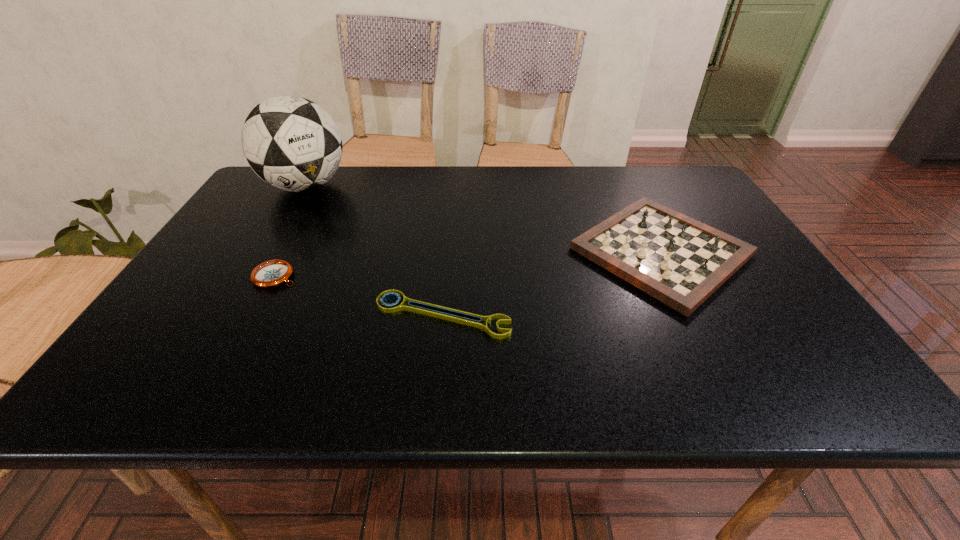
The image size is (960, 540). In order to click on empty space between the shortest object and the tallest object in this screenshot , I will do [x=374, y=251].

This screenshot has width=960, height=540. What are the coordinates of `free area in between the shortest object and the second shortest object` in the screenshot? It's located at (359, 296).

Identify the location of vacant space that is in between the third shortest object and the soccer ball. (483, 219).

I want to click on object that is the closest to the soccer ball, so click(272, 273).

Where is `the closest object to the second shortest object`? The image size is (960, 540). the closest object to the second shortest object is located at coordinates (453, 315).

This screenshot has height=540, width=960. I want to click on vacant area that satisfies the following two spatial constraints: 1. on the surface of the second tallest object where the brand logo is visible; 2. on the left side of the soccer ball, so click(267, 252).

You are a GUI agent. You are given a task and a screenshot of the screen. Output one action in this format:
    pyautogui.click(x=<x>, y=<y>)
    Task: Click on the free spot that satisfies the following two spatial constraints: 1. on the surface of the soccer ball where the brand logo is visible; 2. on the left side of the second object from right to left
    This screenshot has height=540, width=960.
    Given the screenshot: What is the action you would take?
    pyautogui.click(x=229, y=315)

Find the location of a particular element. vacant space that satisfies the following two spatial constraints: 1. on the surface of the third tallest object where the brand logo is visible; 2. on the right side of the tallest object is located at coordinates (252, 276).